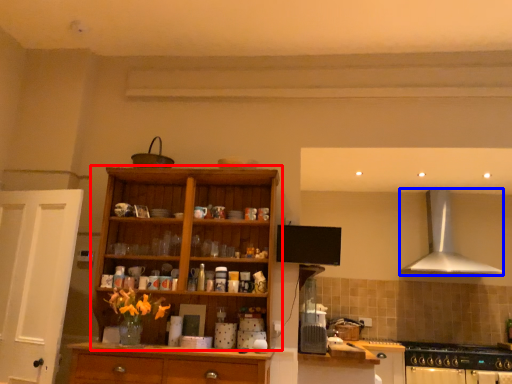
Question: Which point is further to the camera, cupboard (highlighted by a red box) or kitchen appliance (highlighted by a blue box)?

Choices:
 (A) cupboard
 (B) kitchen appliance

Answer: (B)